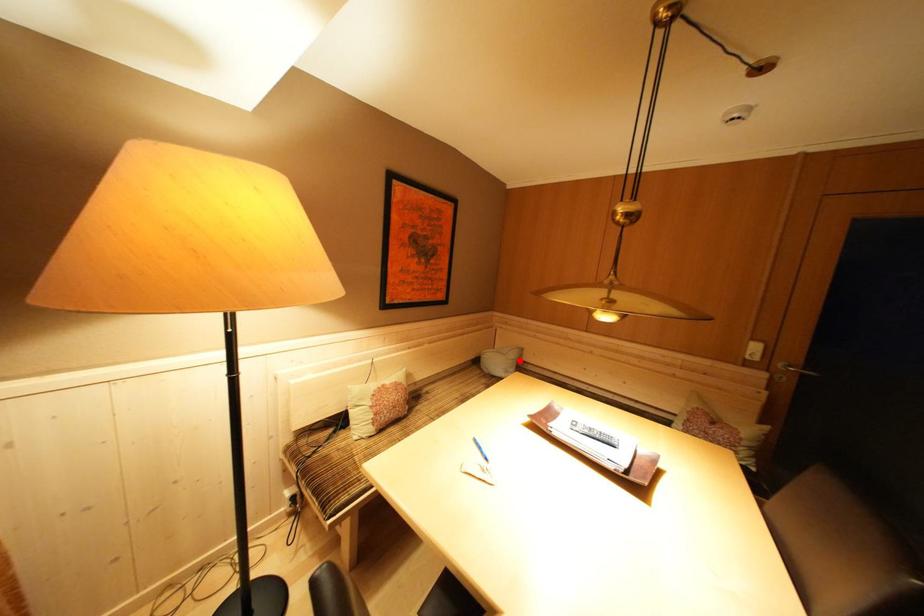
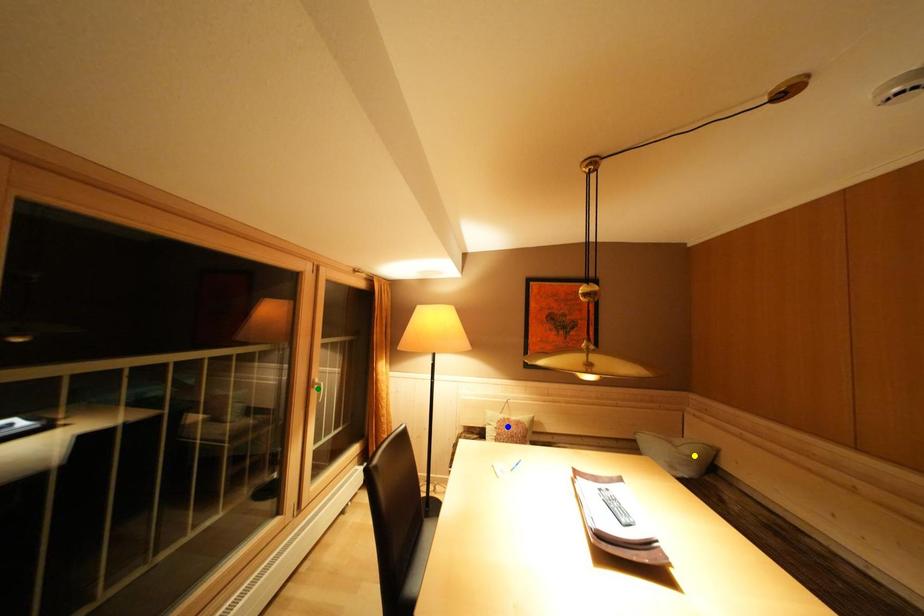
Question: I am providing you with two images of the same scene from different viewpoints. A red point is marked on the first image. You are given multiple points on the second image. Which mark in image 2 goes with the point in image 1?

Choices:
 (A) blue point
 (B) green point
 (C) yellow point

Answer: (C)